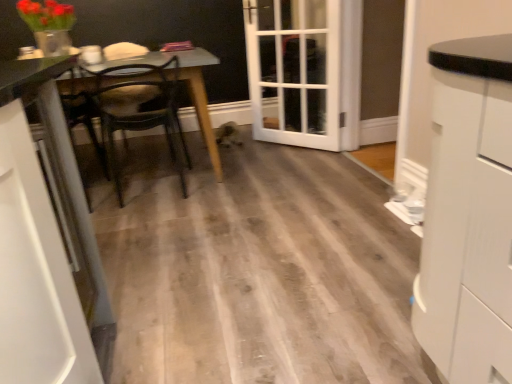
Locate an element on the screen. empty space that is in between white glass door at center and white glossy cabinet at left, arranged as the 1th cabinetry when viewed from the left is located at coordinates (245, 199).